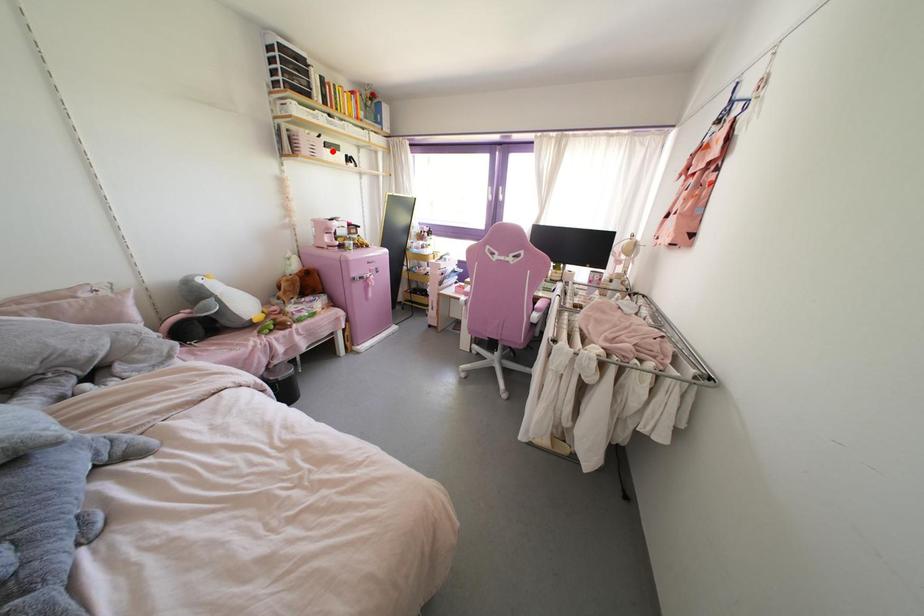
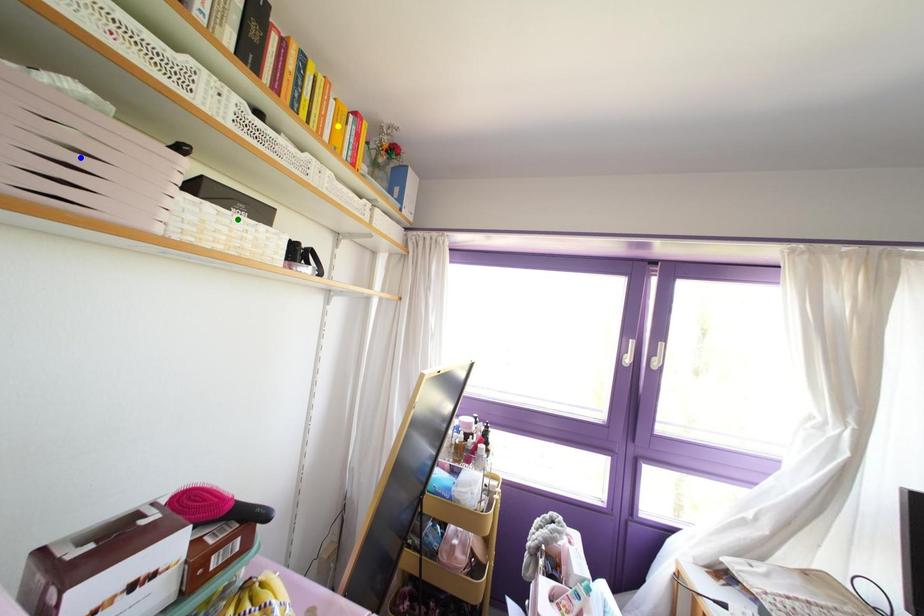
Question: I am providing you with two images of the same scene from different viewpoints. A red point is marked on the first image. You are given multiple points on the second image. Which mark in image 2 goes with the point in image 1?

Choices:
 (A) yellow point
 (B) blue point
 (C) green point

Answer: (C)